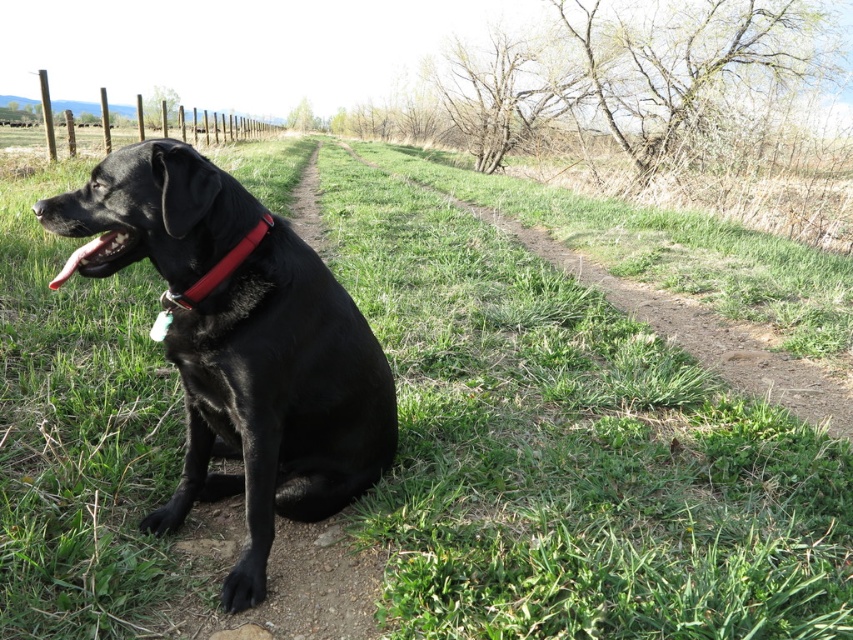
Who is more distant from viewer, (746,333) or (65,278)?

The point (746,333) is more distant.

Who is positioned more to the left, dirt path at center or black rubber mouth at lower left?

Positioned to the left is black rubber mouth at lower left.

Between point (786, 365) and point (105, 243), which one is positioned in front?

Positioned in front is point (105, 243).

Find the location of a particular element. dirt path at center is located at coordinates (701, 333).

Between rubber/soft neckband at center and black rubber mouth at lower left, which one appears on the right side from the viewer's perspective?

Positioned to the right is rubber/soft neckband at center.

Between rubber/soft neckband at center and black rubber mouth at lower left, which one has less height?

With less height is black rubber mouth at lower left.

Between point (235, 244) and point (80, 250), which one is positioned in front?

Positioned in front is point (80, 250).

What are the coordinates of `rubber/soft neckband at center` in the screenshot? It's located at (215, 269).

Does dirt path at center come behind rubber/soft neckband at center?

Yes, it is.

Is dirt path at center thinner than rubber/soft neckband at center?

No.

The width and height of the screenshot is (853, 640). Describe the element at coordinates (701, 333) in the screenshot. I see `dirt path at center` at that location.

The height and width of the screenshot is (640, 853). I want to click on dirt path at center, so click(701, 333).